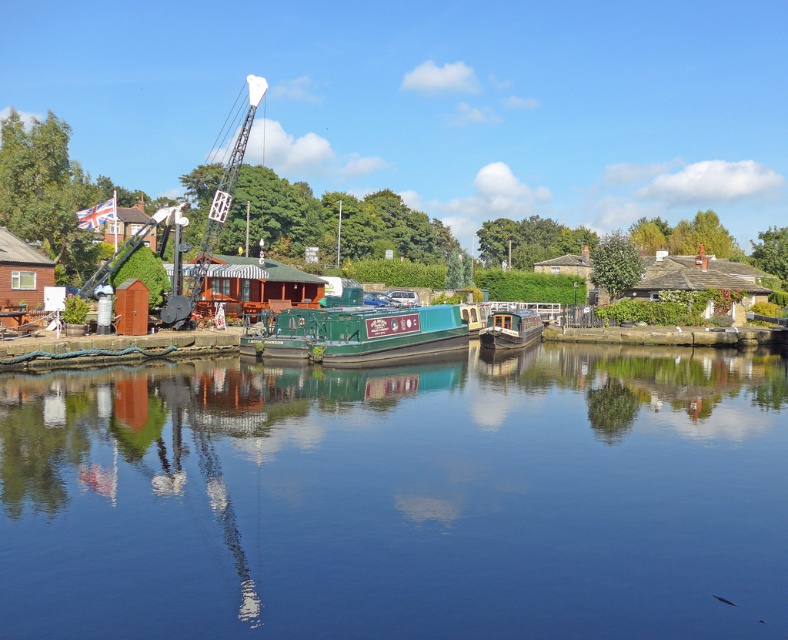
Is point (374, 321) more distant than point (533, 310)?

No, it is in front of (533, 310).

Between green polished wood boat at center and wooden cabin cruiser at center, which one appears on the left side from the viewer's perspective?

green polished wood boat at center

Does point (437, 310) lie behind point (492, 324)?

That is False.

Identify the location of green polished wood boat at center. (361, 333).

Does green polished wood boat at center have a greater width compared to metallic industrial crane at center?

No, green polished wood boat at center is not wider than metallic industrial crane at center.

Who is lower down, green polished wood boat at center or metallic industrial crane at center?

green polished wood boat at center is below.

Which is in front, point (445, 352) or point (229, 154)?

Point (445, 352)

You are a GUI agent. You are given a task and a screenshot of the screen. Output one action in this format:
    pyautogui.click(x=<x>, y=<y>)
    Task: Click on the green polished wood boat at center
    Image resolution: width=788 pixels, height=640 pixels.
    Given the screenshot: What is the action you would take?
    pyautogui.click(x=361, y=333)

Is smooth blue water at center to the right of metallic industrial crane at center from the viewer's perspective?

Indeed, smooth blue water at center is positioned on the right side of metallic industrial crane at center.

Which is above, smooth blue water at center or metallic industrial crane at center?

metallic industrial crane at center

Does point (582, 624) come closer to viewer compared to point (214, 211)?

Yes, it is.

The image size is (788, 640). In order to click on smooth blue water at center in this screenshot , I will do `click(400, 497)`.